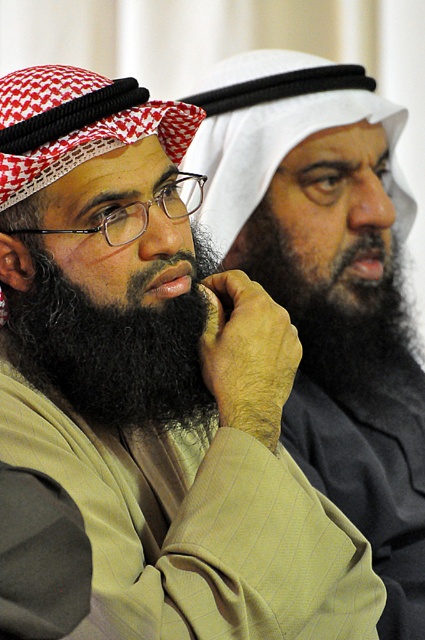
Looking at this image, you are a photographer trying to capture a closeup of the blackwoollybeard at left and the black fuzzy beard at center. Which beard is located lower on the face?

The blackwoollybeard at left is positioned under the black fuzzy beard at center, meaning it is located lower on the face.

You are taking a photo of two people sitting side by side. You want to focus on the person closer to the camera. Which of the two points, point (152, 349) or point (292, 260), should you adjust your camera focus to?

Point (152, 349) is closer to the camera than point (292, 260), so you should adjust your camera focus to point (152, 349).